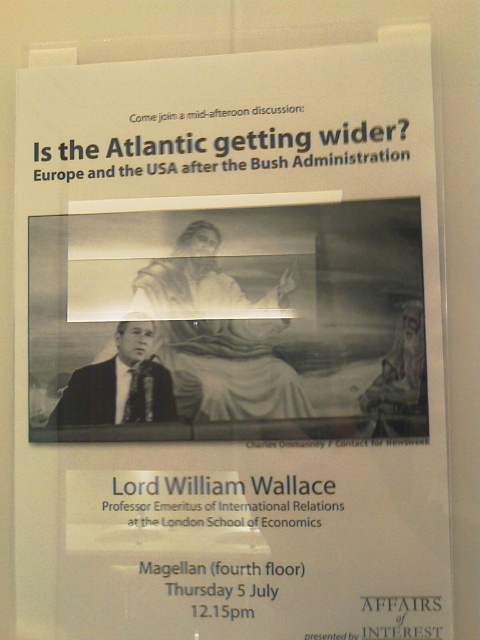
Who is lower down, white paper at center or matte black suit at center?

matte black suit at center is below.

Which is in front, point (192, 410) or point (129, 330)?

Point (192, 410) is in front.

What are the coordinates of `white paper at center` in the screenshot? It's located at (217, 333).